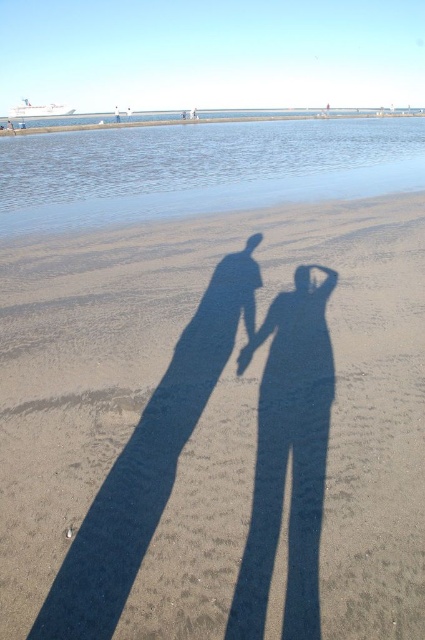
Question: Which point is closer to the camera?

Choices:
 (A) (244, 358)
 (B) (198, 458)

Answer: (B)

Question: Which object is farther from the camera taking this photo?

Choices:
 (A) smooth skin hand at center
 (B) dark sand at center

Answer: (A)

Question: In this image, where is dark sand at center located relative to smooth skin hand at center?

Choices:
 (A) right
 (B) left

Answer: (B)

Question: Can you confirm if dark sand at center is smaller than smooth skin hand at center?

Choices:
 (A) no
 (B) yes

Answer: (A)

Question: Is dark sand at center wider than smooth skin hand at center?

Choices:
 (A) no
 (B) yes

Answer: (B)

Question: Which point appears closest to the camera in this image?

Choices:
 (A) (405, 333)
 (B) (246, 358)

Answer: (B)